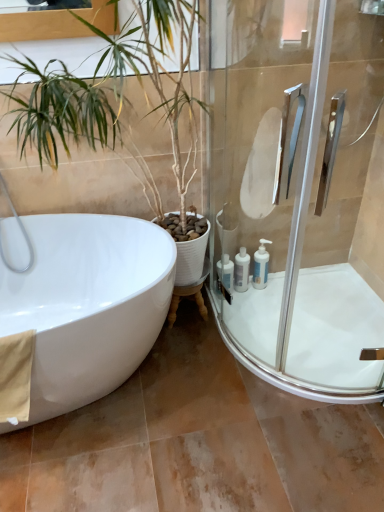
Find the location of a particular element. free space in front of white plastic bottles at lower right, the 3th toiletry viewed from the right is located at coordinates (227, 322).